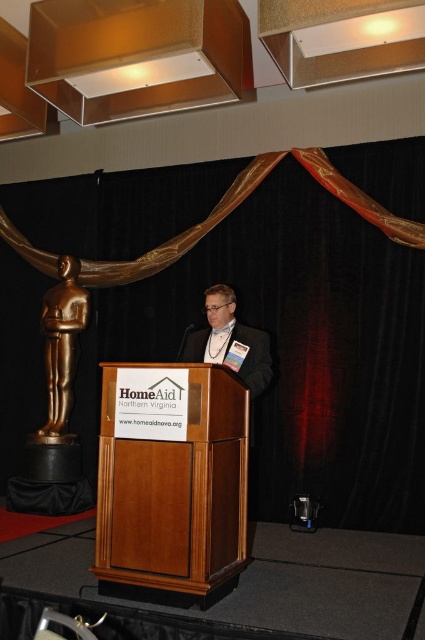
Question: Among these objects, which one is nearest to the camera?

Choices:
 (A) wooden podium at center
 (B) matte black suit at center
 (C) gold polished statue at left
 (D) matte gold fabric at upper center

Answer: (A)

Question: Which is farther from the wooden podium at center?

Choices:
 (A) matte gold fabric at upper center
 (B) matte black suit at center
 (C) gold polished statue at left

Answer: (C)

Question: Where is matte gold fabric at upper center located in relation to gold polished statue at left in the image?

Choices:
 (A) left
 (B) right

Answer: (B)

Question: Is matte gold fabric at upper center below matte black suit at center?

Choices:
 (A) yes
 (B) no

Answer: (B)

Question: Which object is farther from the camera taking this photo?

Choices:
 (A) matte black suit at center
 (B) wooden podium at center
 (C) matte gold fabric at upper center

Answer: (C)

Question: Is gold polished statue at left bigger than matte black suit at center?

Choices:
 (A) no
 (B) yes

Answer: (A)